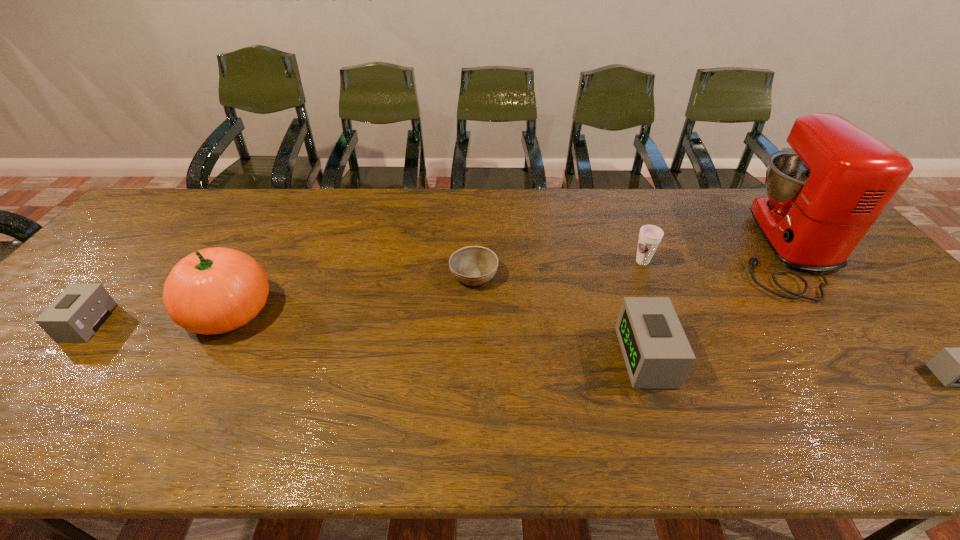
Locate an element on the screen. The width and height of the screenshot is (960, 540). vacant spot for a new alarm_clock to ensure equal spacing is located at coordinates (358, 339).